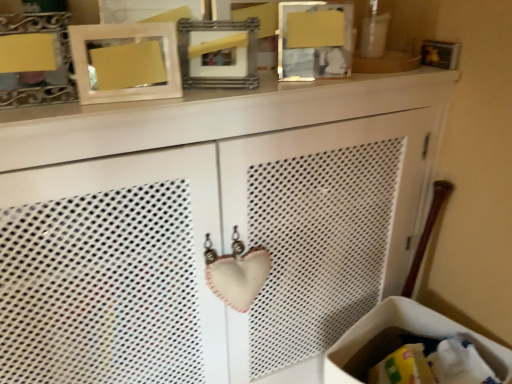
Question: Is metallic silver picture frame at upper center, placed as the third picture frame when sorted from left to right, closer to the viewer compared to wooden picture frame at upper center, the 1th picture frame positioned from the right?

Choices:
 (A) no
 (B) yes

Answer: (B)

Question: Does metallic silver picture frame at upper center, placed as the third picture frame when sorted from left to right, appear on the left side of wooden picture frame at upper center, the 1th picture frame positioned from the right?

Choices:
 (A) yes
 (B) no

Answer: (A)

Question: Can you confirm if metallic silver picture frame at upper center, placed as the third picture frame when sorted from left to right, is wider than wooden picture frame at upper center, the 1th picture frame positioned from the right?

Choices:
 (A) yes
 (B) no

Answer: (A)

Question: Is metallic silver picture frame at upper center, placed as the third picture frame when sorted from left to right, behind wooden picture frame at upper center, the 1th picture frame positioned from the right?

Choices:
 (A) no
 (B) yes

Answer: (A)

Question: Can we say metallic silver picture frame at upper center, placed as the third picture frame when sorted from left to right, lies outside wooden picture frame at upper center, the 1th picture frame positioned from the right?

Choices:
 (A) yes
 (B) no

Answer: (A)

Question: Is metallic silver picture frame at upper center, acting as the second picture frame starting from the right, thinner than wooden picture frame at upper center, the 1th picture frame positioned from the right?

Choices:
 (A) no
 (B) yes

Answer: (A)

Question: Considering the relative sizes of metallic silver picture frame at upper center, placed as the third picture frame when sorted from left to right, and matte silver picture frame at upper left, the first picture frame from the left, in the image provided, is metallic silver picture frame at upper center, placed as the third picture frame when sorted from left to right, wider than matte silver picture frame at upper left, the first picture frame from the left,?

Choices:
 (A) yes
 (B) no

Answer: (A)

Question: Is the depth of metallic silver picture frame at upper center, placed as the third picture frame when sorted from left to right, greater than that of matte silver picture frame at upper left, acting as the 4th picture frame starting from the right?

Choices:
 (A) no
 (B) yes

Answer: (B)

Question: Considering the relative sizes of metallic silver picture frame at upper center, acting as the second picture frame starting from the right, and matte silver picture frame at upper left, acting as the 4th picture frame starting from the right, in the image provided, is metallic silver picture frame at upper center, acting as the second picture frame starting from the right, smaller than matte silver picture frame at upper left, acting as the 4th picture frame starting from the right,?

Choices:
 (A) yes
 (B) no

Answer: (B)

Question: Is metallic silver picture frame at upper center, acting as the second picture frame starting from the right, to the left of matte silver picture frame at upper left, the first picture frame from the left, from the viewer's perspective?

Choices:
 (A) yes
 (B) no

Answer: (B)

Question: Considering the relative sizes of metallic silver picture frame at upper center, placed as the third picture frame when sorted from left to right, and matte silver picture frame at upper left, the first picture frame from the left, in the image provided, is metallic silver picture frame at upper center, placed as the third picture frame when sorted from left to right, shorter than matte silver picture frame at upper left, the first picture frame from the left,?

Choices:
 (A) no
 (B) yes

Answer: (A)

Question: Is metallic silver picture frame at upper center, placed as the third picture frame when sorted from left to right, bigger than matte silver picture frame at upper left, acting as the 4th picture frame starting from the right?

Choices:
 (A) yes
 (B) no

Answer: (A)

Question: From a real-world perspective, is matte white picture frame at upper center, the second picture frame positioned from the left, on metallic silver picture frame at upper center, placed as the third picture frame when sorted from left to right?

Choices:
 (A) no
 (B) yes

Answer: (B)